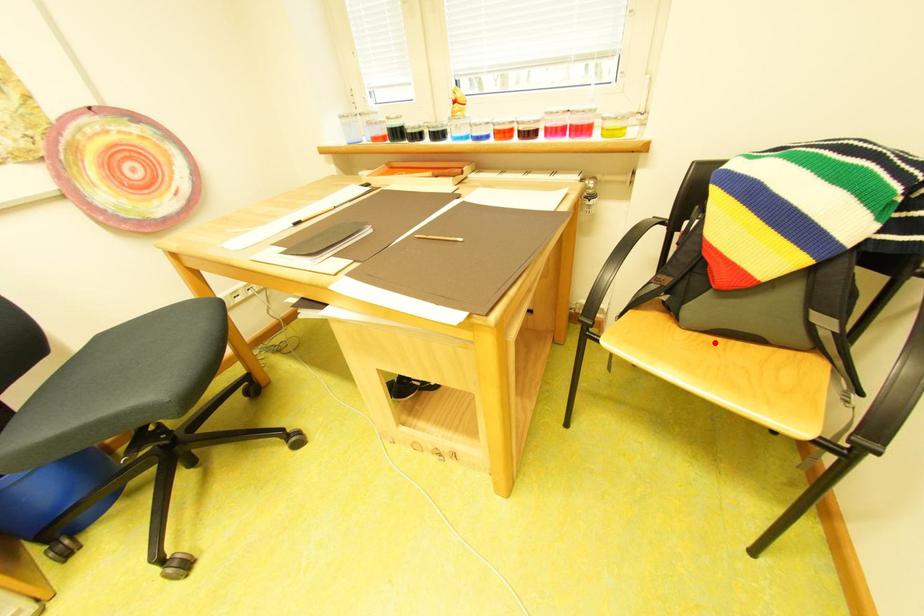
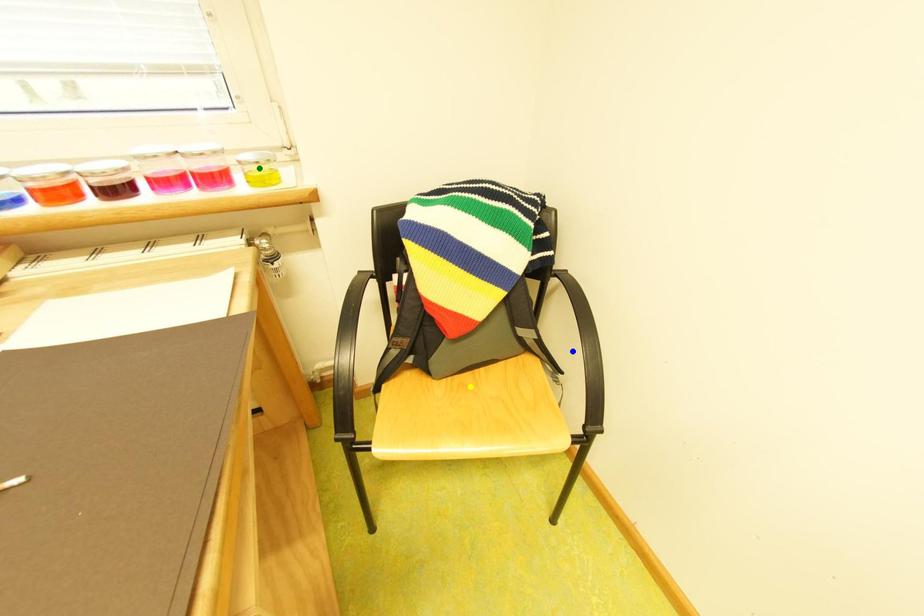
Question: I am providing you with two images of the same scene from different viewpoints. A red point is marked on the first image. You are given multiple points on the second image. In image 2, which mark is for the same physical point as the one in image 1?

Choices:
 (A) green point
 (B) blue point
 (C) yellow point

Answer: (C)